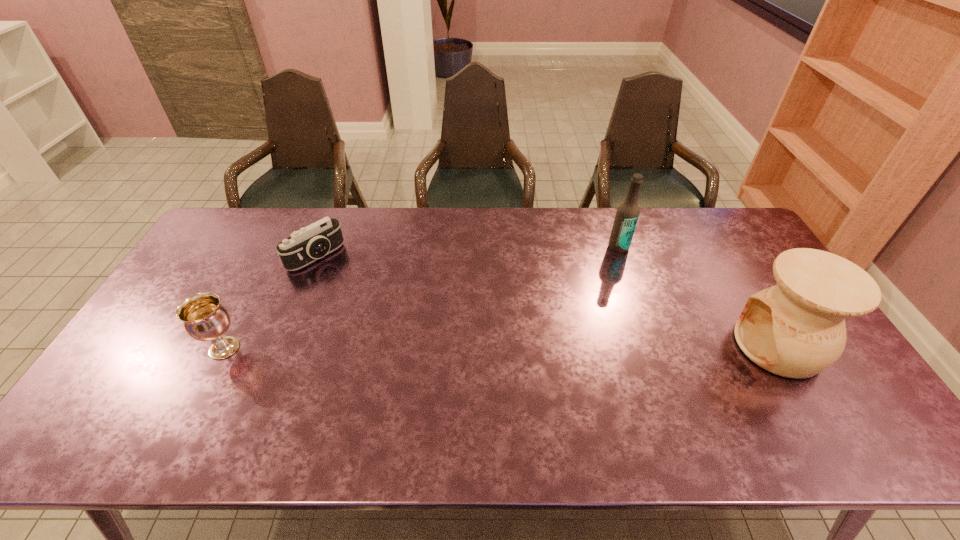
This screenshot has height=540, width=960. Find the location of `vacant space on the desktop that is between the chalice and the rightmost object and is positioned on the front lens of the shortest object`. vacant space on the desktop that is between the chalice and the rightmost object and is positioned on the front lens of the shortest object is located at coordinates (421, 347).

Where is `free space on the desktop that is between the chalice and the pottery and is positioned on the label of the beer bottle`? free space on the desktop that is between the chalice and the pottery and is positioned on the label of the beer bottle is located at coordinates (582, 347).